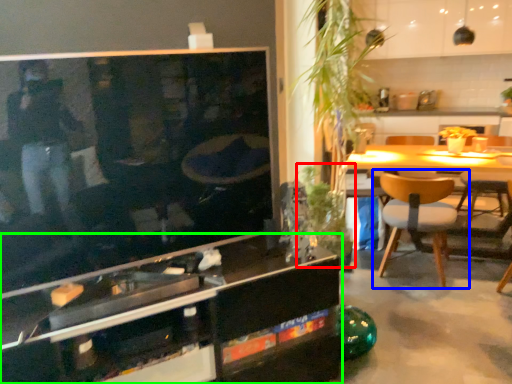
Question: Which object is the closest to the plant (highlighted by a red box)? Choose among these: chair (highlighted by a blue box) or cabinetry (highlighted by a green box).

Choices:
 (A) chair
 (B) cabinetry

Answer: (A)